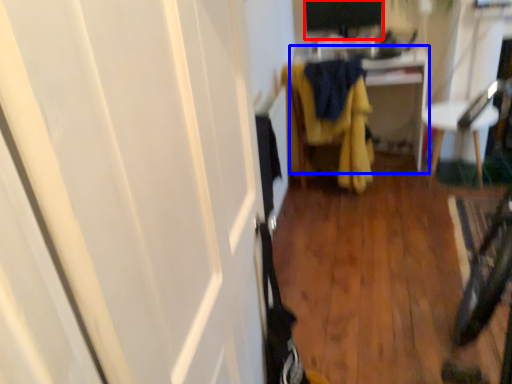
Question: Which of the following is the closest to the observer, computer monitor (highlighted by a red box) or cabinetry (highlighted by a blue box)?

Choices:
 (A) computer monitor
 (B) cabinetry

Answer: (B)